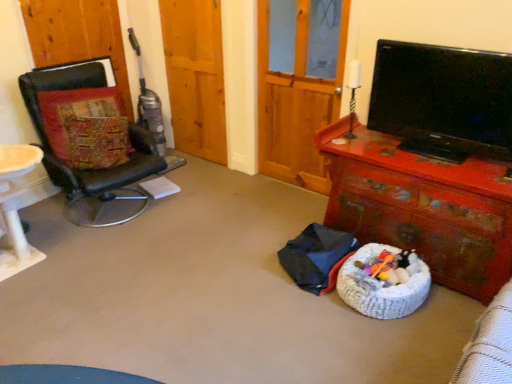
Locate an element on the screen. vacant space in between black leather chair at left and white woven dog bed at lower center is located at coordinates (217, 249).